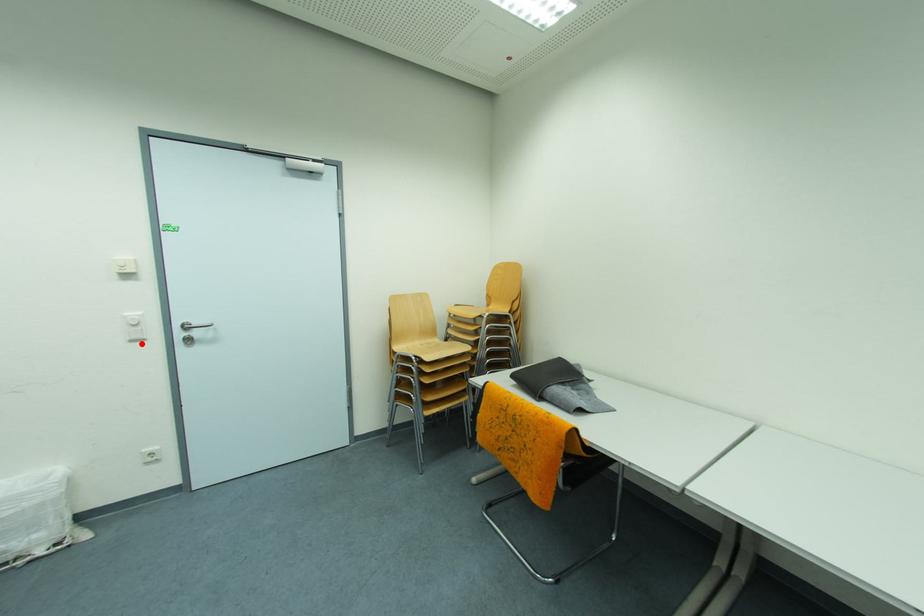
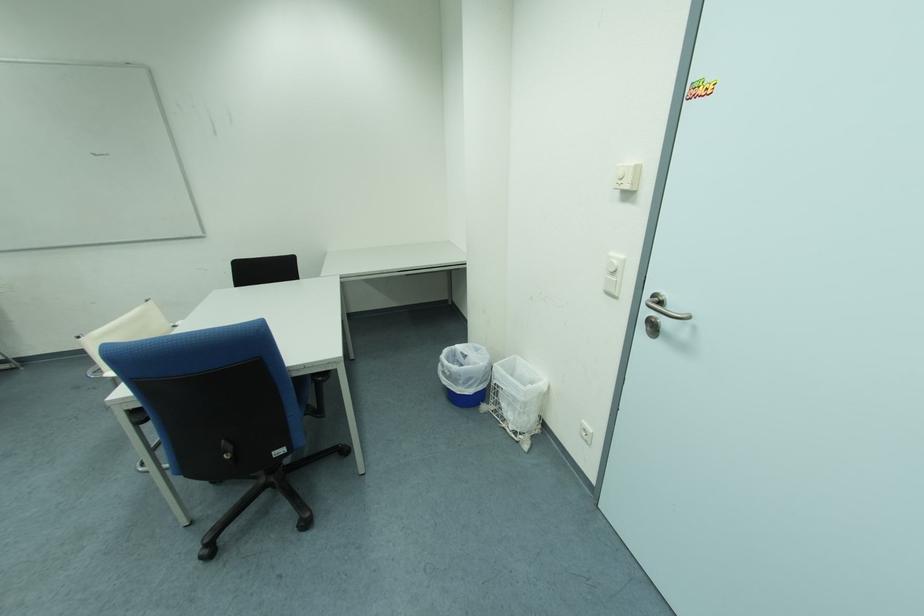
Where in the second image is the point corresponding to the highlighted location from the first image?

(616, 296)